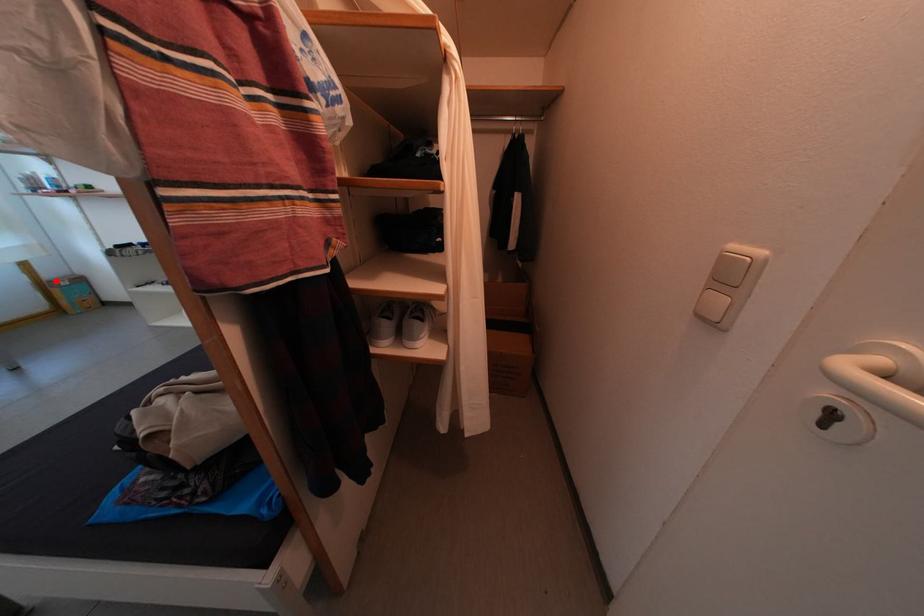
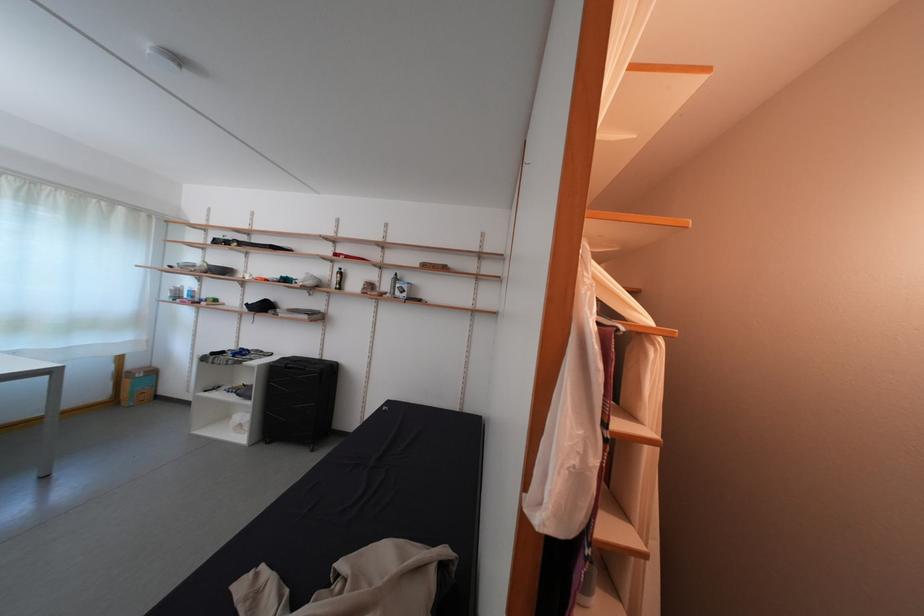
Find the pixel in the second image that matches the highlighted location in the first image.

(140, 371)